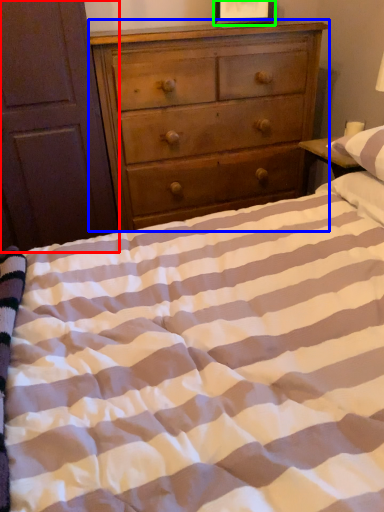
Question: Which object is positioned farthest from armoire (highlighted by a red box)? Select from chest of drawers (highlighted by a blue box) and picture frame (highlighted by a green box).

Choices:
 (A) chest of drawers
 (B) picture frame

Answer: (B)